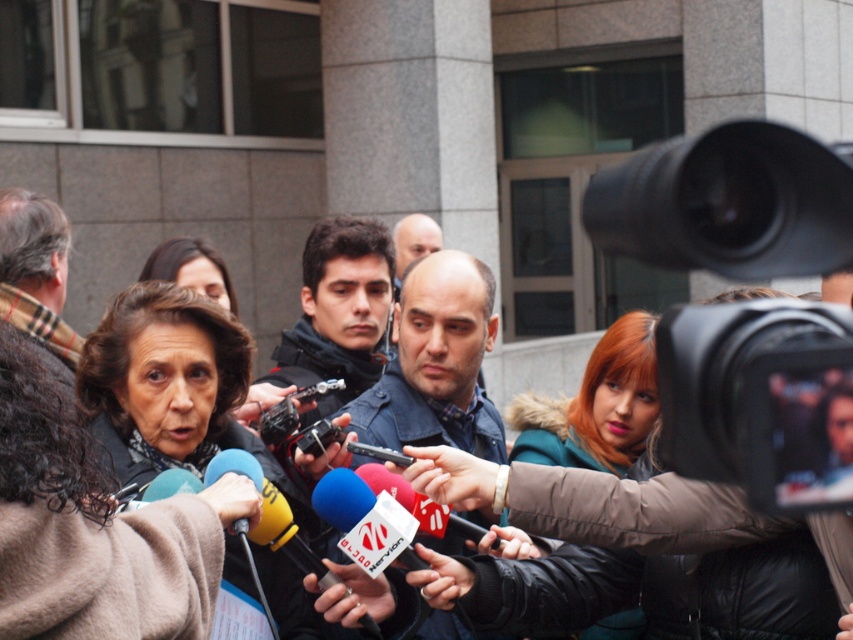
You are standing at the point with coordinates point (306,285) and want to move towards the point (170,300). Based on the scene description, is the point you want to reach located in front of or behind your current position?

The point (170,300) is in front of point (306,285), so the destination is in front of your current position.

From the picture: You are a photographer at the event and want to capture a photo that includes both the dark brown hair at center and the dark blue jacket at center. Based on their positions, which one should you focus on first to ensure both are in frame?

Since the dark brown hair at center is positioned on the left side of dark blue jacket at center, you should focus on the dark brown hair at center first to ensure both are included in the frame.